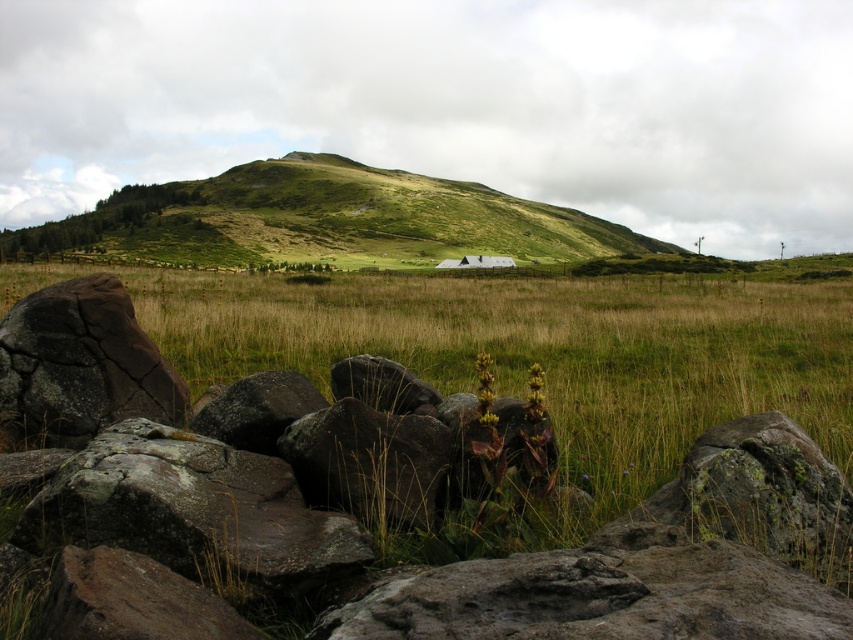
Question: Which of the following is the farthest from the observer?

Choices:
 (A) rusty stone boulder at lower left
 (B) dark brown cracked rock at lower left

Answer: (B)

Question: Does green grassy hillside at upper center appear over rusty metallic boulder at center?

Choices:
 (A) no
 (B) yes

Answer: (B)

Question: Among these objects, which one is farthest from the camera?

Choices:
 (A) green grassy hillside at upper center
 (B) rusty stone boulder at lower left

Answer: (A)

Question: Is rusty stone boulder at lower left above rusty metallic boulder at center?

Choices:
 (A) no
 (B) yes

Answer: (A)

Question: Is dark brown cracked rock at lower left to the left of rusty metallic boulder at center from the viewer's perspective?

Choices:
 (A) no
 (B) yes

Answer: (B)

Question: Which point is farther from the camera taking this photo?

Choices:
 (A) (97, 380)
 (B) (276, 193)

Answer: (B)